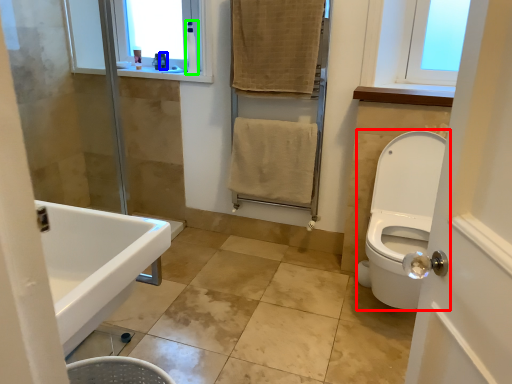
Question: Based on their relative distances, which object is nearer to toilet (highlighted by a red box)? Choose from toiletry (highlighted by a blue box) and toiletry (highlighted by a green box).

Choices:
 (A) toiletry
 (B) toiletry

Answer: (B)